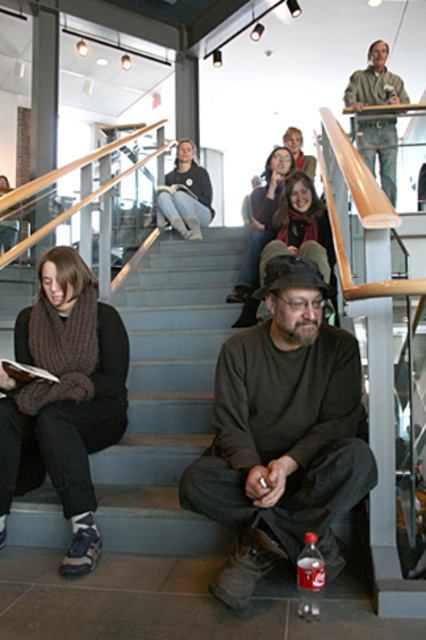
You are organizing a photo shoot and need to place a small decorative pillow between the knitted scarf at left and the knitted scarf at upper center. Based on their sizes, which scarf should the pillow be placed closer to?

The knitted scarf at left is much taller than the knitted scarf at upper center, so the pillow should be placed closer to the knitted scarf at upper center to balance the composition.

You are standing at the bottom of the staircase and see two scarves, a knitted scarf at upper center and a knit scarf at upper center. Which one is closer to you?

The knitted scarf at upper center is closer to you since it is 6.20 feet away from the knit scarf at upper center, but since both are at the same location, they are equally distant from you.